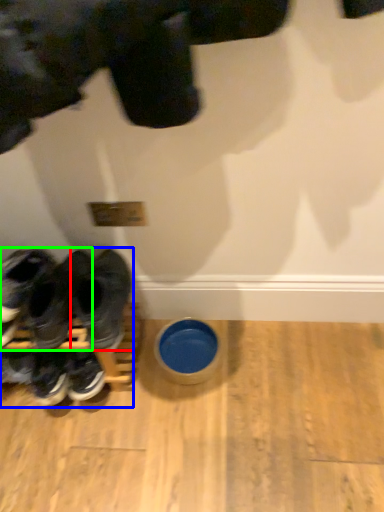
Question: Considering the real-world distances, which object is farthest from footwear (highlighted by a red box)? footwear (highlighted by a blue box) or footwear (highlighted by a green box)?

Choices:
 (A) footwear
 (B) footwear

Answer: (B)